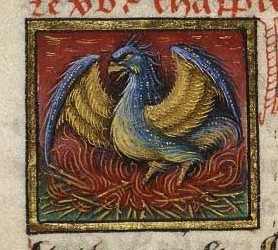
Where is `top left gold corner of framed bird picture`? top left gold corner of framed bird picture is located at coordinates (30, 26).